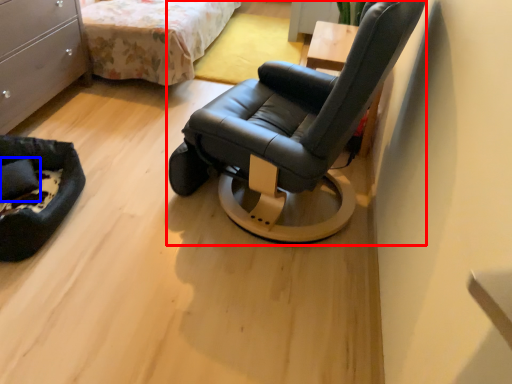
Question: Which object appears closest to the camera in this image, chair (highlighted by a red box) or pillow (highlighted by a blue box)?

Choices:
 (A) chair
 (B) pillow

Answer: (A)